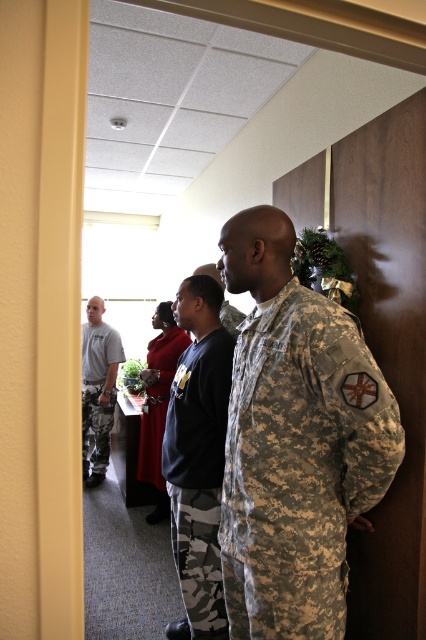
You are standing at the doorway and see a point marked at coordinates (198, 474). What object is located at that point?

The point at coordinates (198, 474) marks the camo fabric uniform at center.

You are a tailor measuring the distance between two camouflage items in the image. The gray camo pants at left and the camouflage fabric uniform at center are both in need of alterations. Can your measuring tape, which is 30 inches long, reach between them to measure the distance?

The distance between the gray camo pants at left and the camouflage fabric uniform at center is 28.13 inches, so yes, the measuring tape can reach between them since it is longer than the distance.

Looking at this image, you are standing at the doorway of the office. You need to locate the gray camo pants at left. According to the coordinates provided, where exactly should you look to find them?

The gray camo pants at left are located at the coordinates point (97, 388).